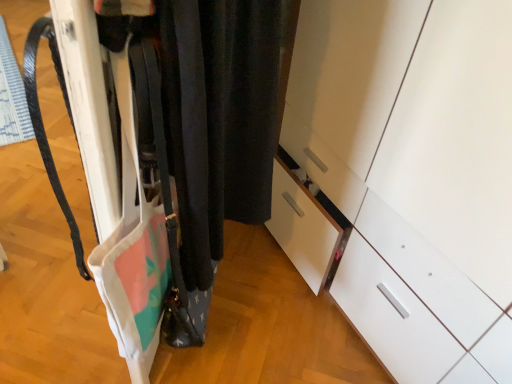
Question: From a real-world perspective, is white matte closet at center above or below white glossy cabinet at center?

Choices:
 (A) above
 (B) below

Answer: (A)

Question: Considering the positions of point (95, 92) and point (378, 97), is point (95, 92) closer or farther from the camera than point (378, 97)?

Choices:
 (A) closer
 (B) farther

Answer: (A)

Question: Choose the correct answer: Is white matte closet at center inside white glossy cabinet at center or outside it?

Choices:
 (A) outside
 (B) inside

Answer: (A)

Question: From a real-world perspective, is white glossy cabinet at center physically located above or below white matte closet at center?

Choices:
 (A) below
 (B) above

Answer: (A)

Question: Is white glossy cabinet at center inside or outside of white matte closet at center?

Choices:
 (A) inside
 (B) outside

Answer: (B)

Question: Relative to white matte closet at center, is white glossy cabinet at center in front or behind?

Choices:
 (A) front
 (B) behind

Answer: (B)

Question: Is point (476, 145) positioned closer to the camera than point (132, 345)?

Choices:
 (A) closer
 (B) farther

Answer: (A)